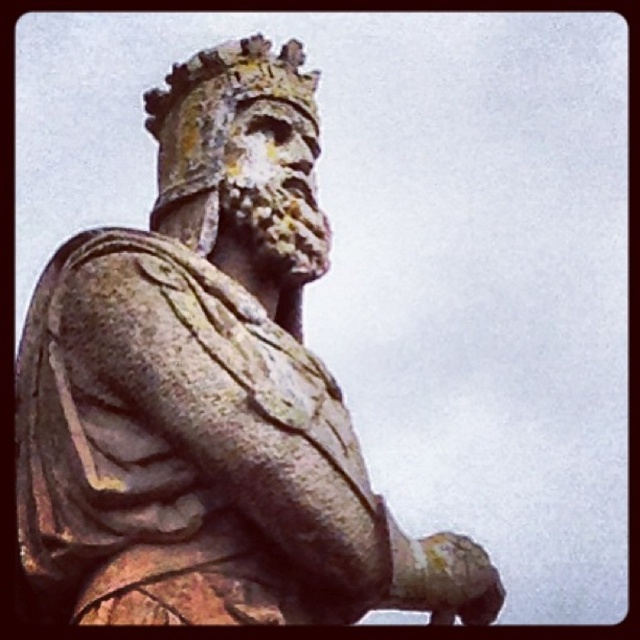
You are a photographer adjusting your camera settings to focus on two points on the statue. The first point is at coordinate point (317, 420) and the second is at point (195, 54). Which point should you focus on first if you want to ensure the closest point is sharp?

Point (317, 420) is closer to the camera than point (195, 54), so you should focus on point (317, 420) first to ensure the closest point is sharp.